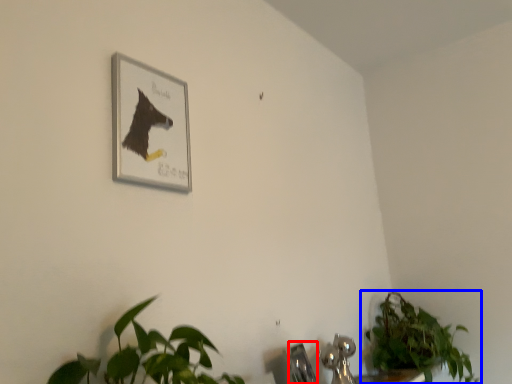
Question: Among these objects, which one is farthest to the camera, faucet (highlighted by a red box) or houseplant (highlighted by a blue box)?

Choices:
 (A) faucet
 (B) houseplant

Answer: (B)